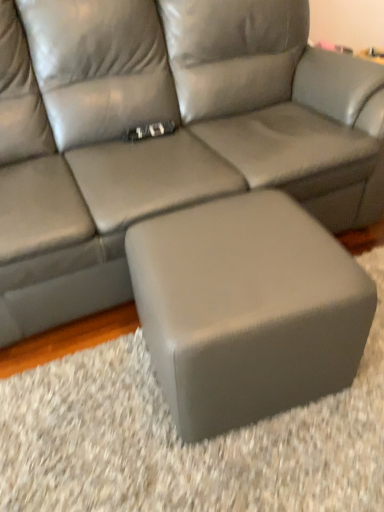
This screenshot has height=512, width=384. What are the coordinates of `vacant space in front of matte gray ottoman at center` in the screenshot? It's located at (254, 465).